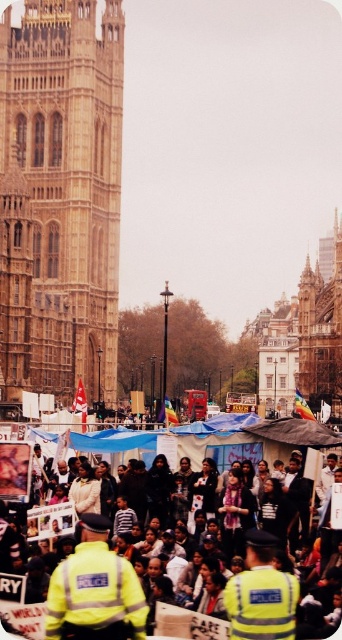
Between golden stone tower at center and reflective yellow jacket at lower left, which one is positioned higher?

golden stone tower at center

Between golden stone tower at center and reflective yellow jacket at lower left, which one appears on the right side from the viewer's perspective?

Positioned to the right is reflective yellow jacket at lower left.

Which is behind, point (77, 3) or point (130, 566)?

The point (77, 3) is more distant.

I want to click on golden stone tower at center, so click(x=60, y=196).

Who is positioned more to the right, golden stone tower at center or yellow reflective vests at center?

From the viewer's perspective, yellow reflective vests at center appears more on the right side.

What do you see at coordinates (60, 196) in the screenshot?
I see `golden stone tower at center` at bounding box center [60, 196].

The height and width of the screenshot is (640, 342). What do you see at coordinates (60, 196) in the screenshot?
I see `golden stone tower at center` at bounding box center [60, 196].

Where is `golden stone tower at center`? golden stone tower at center is located at coordinates (60, 196).

I want to click on reflective yellow jacket at lower left, so (x=95, y=589).

Describe the element at coordinates (95, 589) in the screenshot. I see `reflective yellow jacket at lower left` at that location.

Where is `reflective yellow jacket at lower left`? This screenshot has height=640, width=342. reflective yellow jacket at lower left is located at coordinates (95, 589).